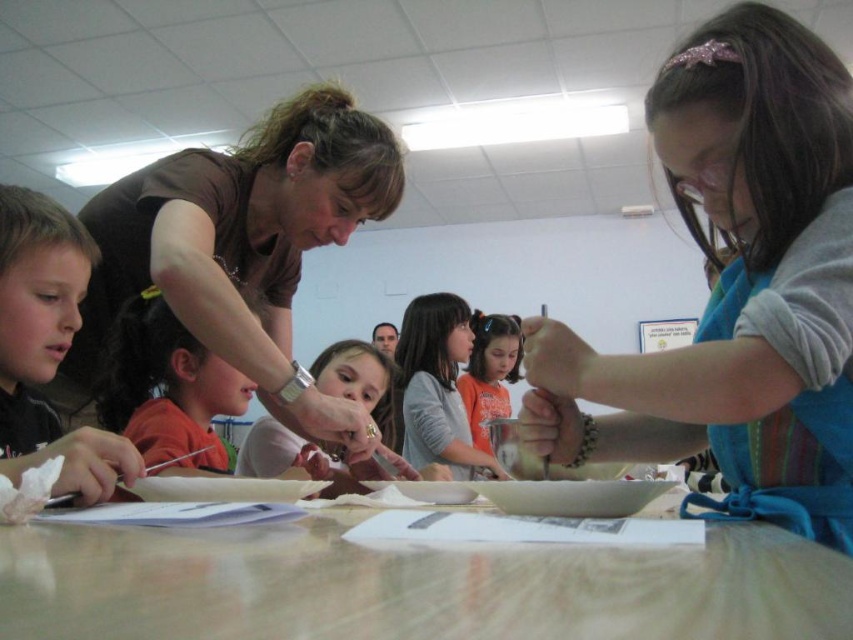
You are standing in front of the classroom table and want to reach a point that is exactly at coordinates point (328, 605). If your arm can extend 12 inches, can you comfortably reach that point without moving your body?

The distance of point (328, 605) from the camera is 11.43 inches. Since your arm can extend 12 inches, you can comfortably reach the point without moving your body.

You are a teacher standing at the back of the classroom. You need to walk to the table to assist the children. The classroom has a 1.2 meter wide doorway leading to the hallway. If you first pass by the brown matte shirt at upper left, will you have enough space to reach the gray fabric shirt at center without squeezing through?

The distance between the brown matte shirt at upper left and gray fabric shirt at center is 1.19 meters. Since the doorway is 1.2 meters wide, there is enough space to move between them without squeezing.

You are a teacher observing the children at the table. You need to hand out a task that requires a larger workspace. Which child should you assign the task to, the one wearing the gray fabric shirt at center or the orange cotton shirt at center?

The gray fabric shirt at center is larger in size than the orange cotton shirt at center, so you should assign the task to the child wearing the gray fabric shirt at center as they likely have more space available.